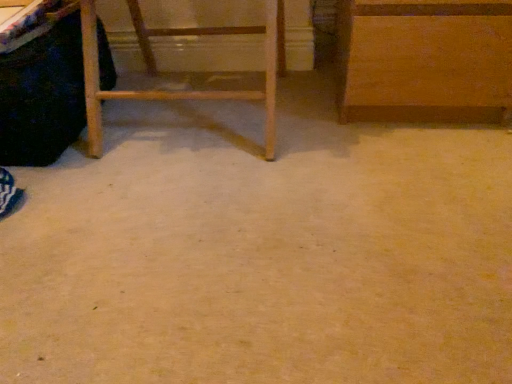
Question: Is wooden cabinet at upper right, arranged as the first furniture when viewed from the right, further to the viewer compared to black fabric vanity at left?

Choices:
 (A) no
 (B) yes

Answer: (B)

Question: Is wooden cabinet at upper right, arranged as the first furniture when viewed from the right, far away from black fabric vanity at left?

Choices:
 (A) yes
 (B) no

Answer: (B)

Question: Is wooden cabinet at upper right, the 2th furniture from the left, oriented away from black fabric vanity at left?

Choices:
 (A) yes
 (B) no

Answer: (B)

Question: Does wooden cabinet at upper right, the 2th furniture from the left, have a smaller size compared to black fabric vanity at left?

Choices:
 (A) yes
 (B) no

Answer: (B)

Question: Is the depth of wooden cabinet at upper right, arranged as the first furniture when viewed from the right, less than that of black fabric vanity at left?

Choices:
 (A) yes
 (B) no

Answer: (B)

Question: Considering the relative positions of wooden cabinet at upper right, arranged as the first furniture when viewed from the right, and black fabric vanity at left in the image provided, is wooden cabinet at upper right, arranged as the first furniture when viewed from the right, to the left of black fabric vanity at left from the viewer's perspective?

Choices:
 (A) no
 (B) yes

Answer: (A)

Question: Does wooden cabinet at upper right, arranged as the first furniture when viewed from the right, have a greater width compared to wooden ladder at left, the first furniture positioned from the left?

Choices:
 (A) no
 (B) yes

Answer: (B)

Question: Is wooden cabinet at upper right, arranged as the first furniture when viewed from the right, not inside wooden ladder at left, the first furniture positioned from the left?

Choices:
 (A) yes
 (B) no

Answer: (A)

Question: Is wooden cabinet at upper right, arranged as the first furniture when viewed from the right, shorter than wooden ladder at left, the first furniture positioned from the left?

Choices:
 (A) no
 (B) yes

Answer: (B)

Question: Considering the relative positions of wooden cabinet at upper right, the 2th furniture from the left, and wooden ladder at left, the 2th furniture when ordered from right to left, in the image provided, is wooden cabinet at upper right, the 2th furniture from the left, to the right of wooden ladder at left, the 2th furniture when ordered from right to left, from the viewer's perspective?

Choices:
 (A) no
 (B) yes

Answer: (B)

Question: From the image's perspective, is wooden cabinet at upper right, the 2th furniture from the left, on top of wooden ladder at left, the 2th furniture when ordered from right to left?

Choices:
 (A) no
 (B) yes

Answer: (B)

Question: Considering the relative positions of wooden cabinet at upper right, arranged as the first furniture when viewed from the right, and wooden ladder at left, the 2th furniture when ordered from right to left, in the image provided, is wooden cabinet at upper right, arranged as the first furniture when viewed from the right, to the left of wooden ladder at left, the 2th furniture when ordered from right to left, from the viewer's perspective?

Choices:
 (A) yes
 (B) no

Answer: (B)

Question: Does black fabric vanity at left appear on the right side of wooden ladder at left, the 2th furniture when ordered from right to left?

Choices:
 (A) yes
 (B) no

Answer: (B)